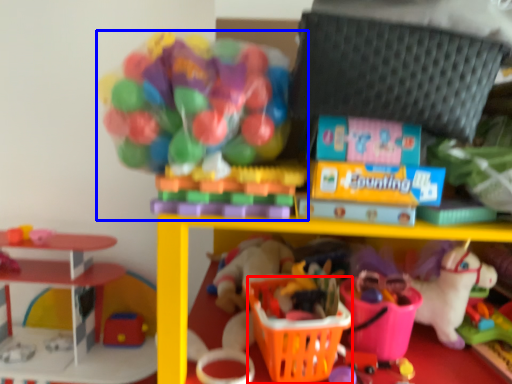
Question: Which of the following is the closest to the observer, basket (highlighted by a red box) or toy (highlighted by a blue box)?

Choices:
 (A) basket
 (B) toy

Answer: (B)